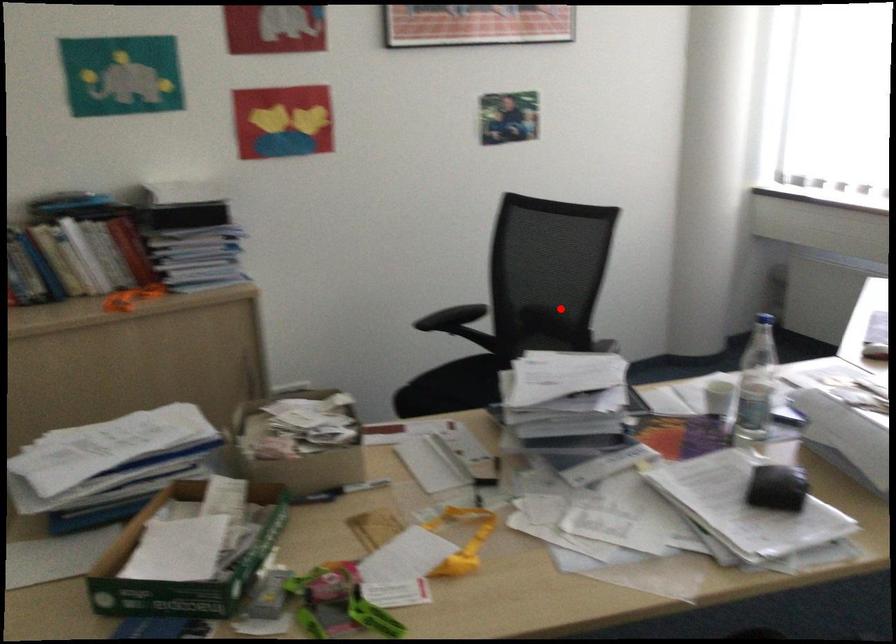
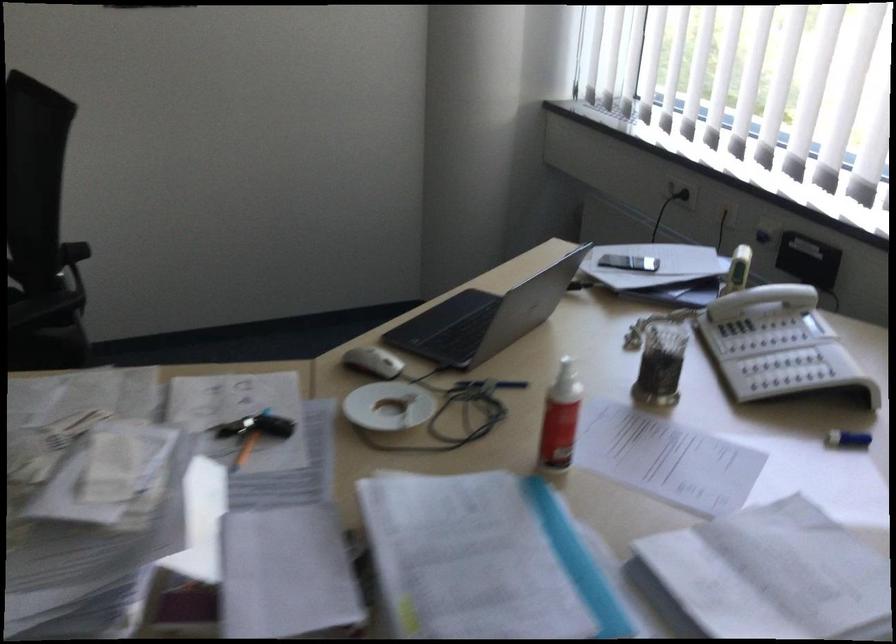
Question: I am providing you with two images of the same scene from different viewpoints. A red point is marked on the first image. Can you still see the location of the red point in image 2?

Choices:
 (A) Yes
 (B) No

Answer: (A)